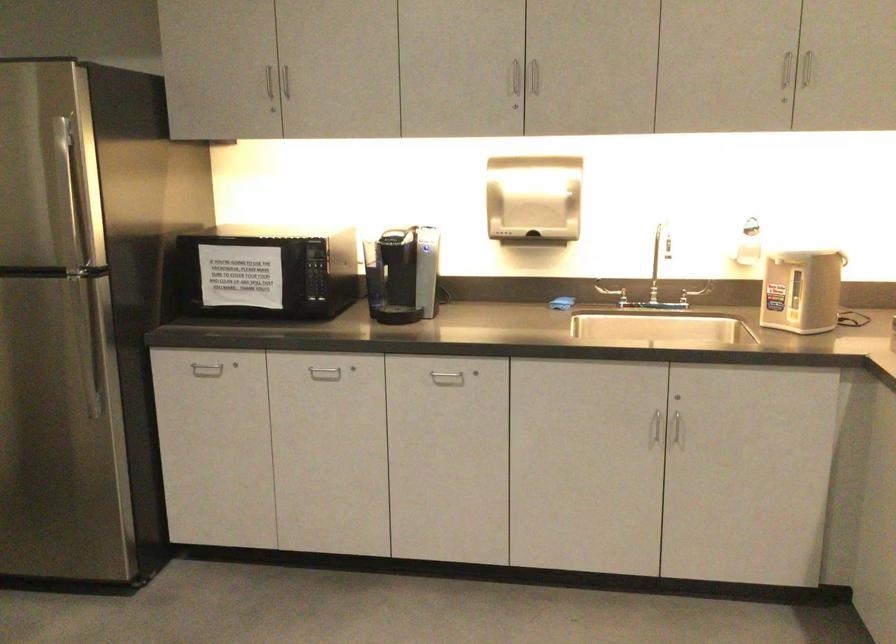
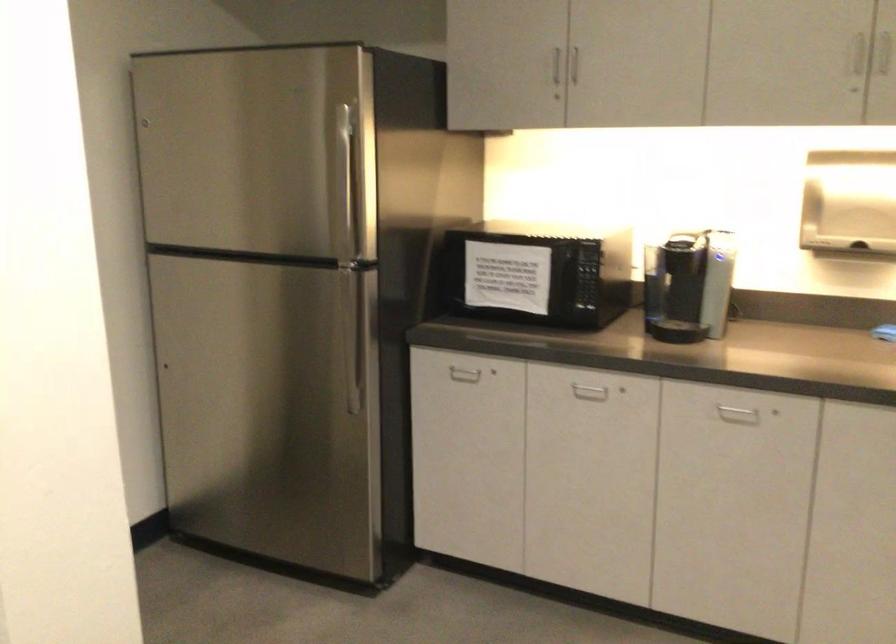
Question: Based on the continuous images, in which direction is the camera rotating? Reply with the corresponding letter.

Choices:
 (A) Left
 (B) Right
 (C) Up
 (D) Down

Answer: (A)